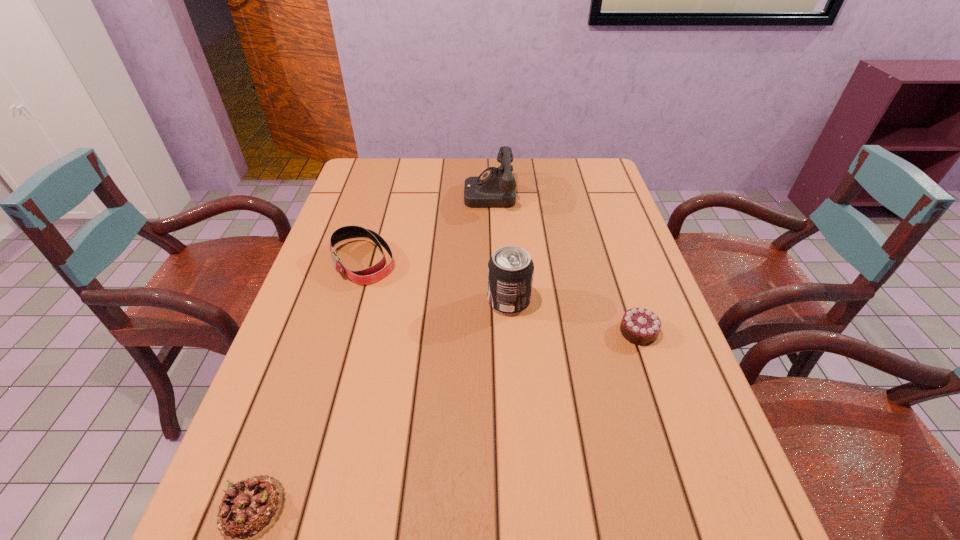
Where is `vacant area located on the left of the right chocolate cake`? vacant area located on the left of the right chocolate cake is located at coordinates (453, 332).

The height and width of the screenshot is (540, 960). Identify the location of object present at the far edge. (495, 187).

Locate an element on the screen. object that is at the left edge is located at coordinates (370, 275).

Identify the location of object positioned at the right edge. pyautogui.click(x=639, y=326).

Where is `free region at the far edge`? The width and height of the screenshot is (960, 540). free region at the far edge is located at coordinates (526, 189).

In the image, there is a desktop. Identify the location of free space at the near edge. (540, 525).

The height and width of the screenshot is (540, 960). What are the coordinates of `free region at the left edge of the desktop` in the screenshot? It's located at (325, 341).

The height and width of the screenshot is (540, 960). I want to click on vacant area at the right edge, so click(x=630, y=248).

In the image, there is a desktop. At what (x,y) coordinates should I click in order to perform the action: click on vacant region at the far left corner. Please return your answer as a coordinate pair (x, y). This screenshot has height=540, width=960. Looking at the image, I should click on (356, 177).

Where is `free space at the near left corner of the desktop`? This screenshot has height=540, width=960. free space at the near left corner of the desktop is located at coordinates (276, 528).